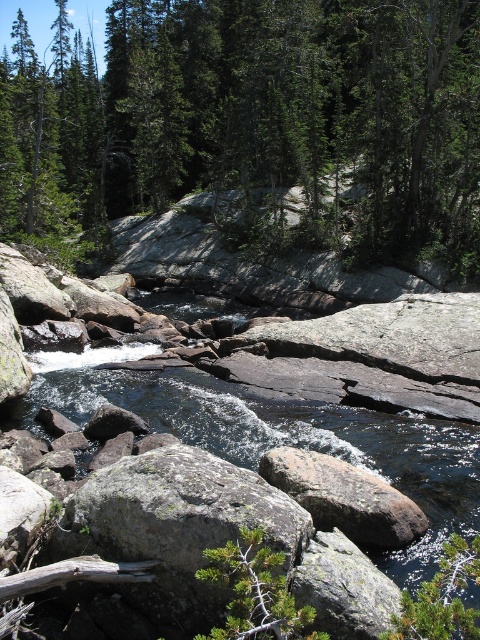
Question: Does green leafy tree at center have a lesser width compared to rusty metallic rock at center?

Choices:
 (A) no
 (B) yes

Answer: (A)

Question: Which point is closer to the camera taking this photo?

Choices:
 (A) (387, 99)
 (B) (417, 536)

Answer: (B)

Question: Is green leafy tree at center in front of rusty metallic rock at center?

Choices:
 (A) yes
 (B) no

Answer: (B)

Question: Can you confirm if green leafy tree at center is bigger than rusty metallic rock at center?

Choices:
 (A) yes
 (B) no

Answer: (A)